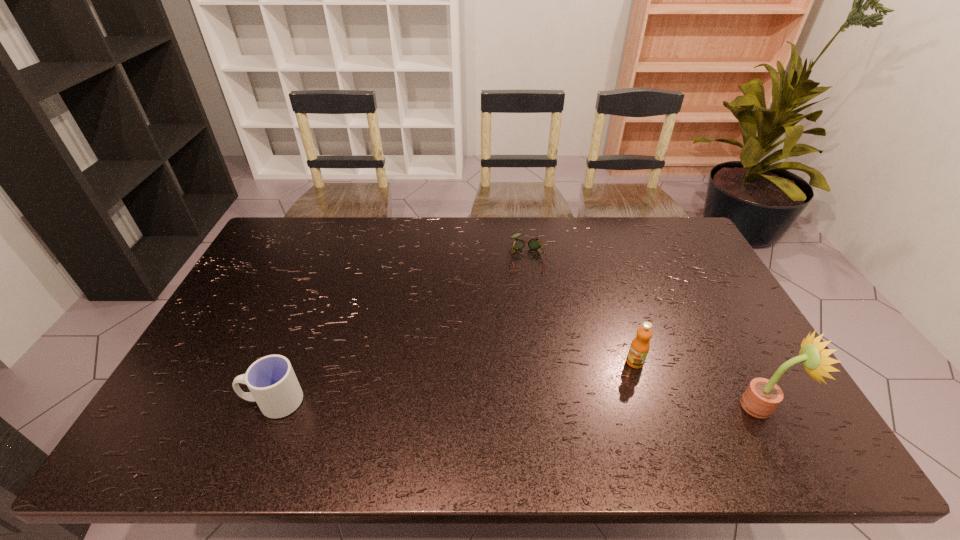
In order to click on free space on the desktop that is between the second shortest object and the tallest object and is positioned on the front-facing side of the shortest object in this screenshot , I will do `click(545, 404)`.

Locate an element on the screen. free space on the desktop that is between the second shortest object and the rightmost object and is positioned on the front label of the second tallest object is located at coordinates (574, 404).